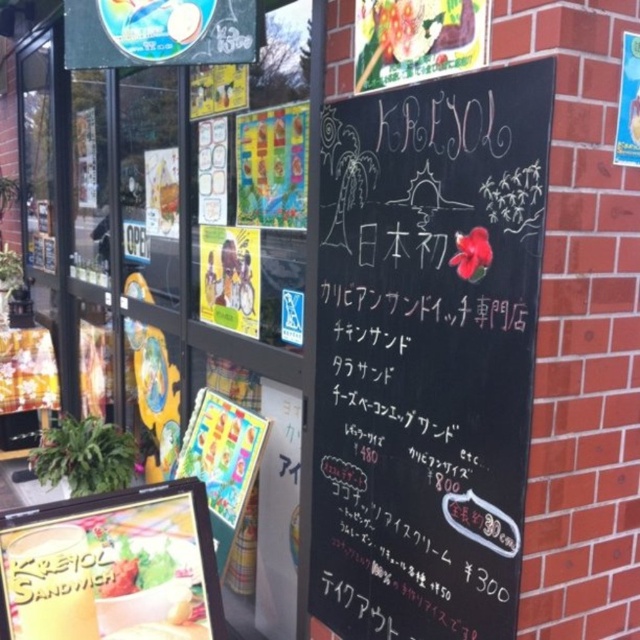
In the scene shown: You are a customer entering the restaurant and see the black chalkboard at center and the green leafy salad at lower left. Which object is wider?

The black chalkboard at center is wider than the green leafy salad at lower left.

You are a customer standing outside the restaurant looking at the menu. You notice the black chalkboard at center and the green leafy salad at lower left. Which object is higher up in the image?

The black chalkboard at center is located above the green leafy salad at lower left, so it is higher up in the image.

Please describe the location of the point labeled as point (x=428, y=353) in the image of the restaurant exterior.

The point labeled as point (x=428, y=353) is located on the black chalkboard at center.